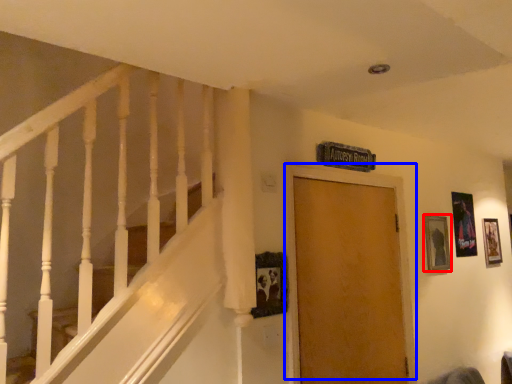
Question: Which point is further to the camera, picture frame (highlighted by a red box) or door (highlighted by a blue box)?

Choices:
 (A) picture frame
 (B) door

Answer: (A)